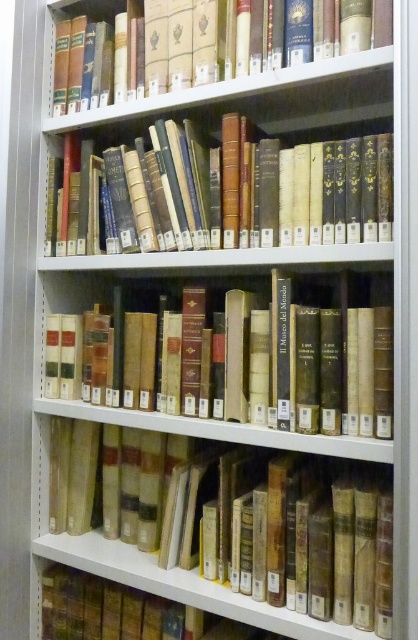
Which is more to the left, brown leather book at center or hardcover books at upper center?

Positioned to the left is hardcover books at upper center.

What do you see at coordinates (246, 362) in the screenshot? I see `brown leather book at center` at bounding box center [246, 362].

Does point (241, 397) come behind point (247, 77)?

Yes.

Where is `brown leather book at center`? The width and height of the screenshot is (418, 640). brown leather book at center is located at coordinates (246, 362).

Can you confirm if brown leather book at center is positioned below leather-bound books at center?

Yes, brown leather book at center is below leather-bound books at center.

Does brown leather book at center have a smaller size compared to leather-bound books at center?

Actually, brown leather book at center might be larger than leather-bound books at center.

Is point (270, 374) positioned after point (259, 157)?

No.

At what (x,y) coordinates should I click in order to perform the action: click on brown leather book at center. Please return your answer as a coordinate pair (x, y). Looking at the image, I should click on (246, 362).

Which is above, yellowish paper book at center or hardcover books at upper center?

hardcover books at upper center

Which of these two, yellowish paper book at center or hardcover books at upper center, stands taller?

With more height is yellowish paper book at center.

Who is more forward, (111, 628) or (143, 3)?

Point (143, 3)

Find the location of a particular element. yellowish paper book at center is located at coordinates 213,534.